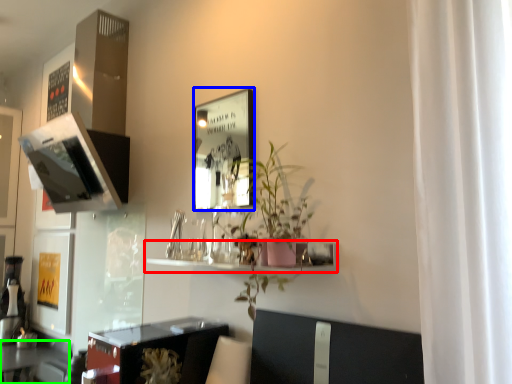
Question: Which object is positioned closest to shelf (highlighted by a red box)? Select from picture frame (highlighted by a blue box) and table (highlighted by a green box).

Choices:
 (A) picture frame
 (B) table

Answer: (B)